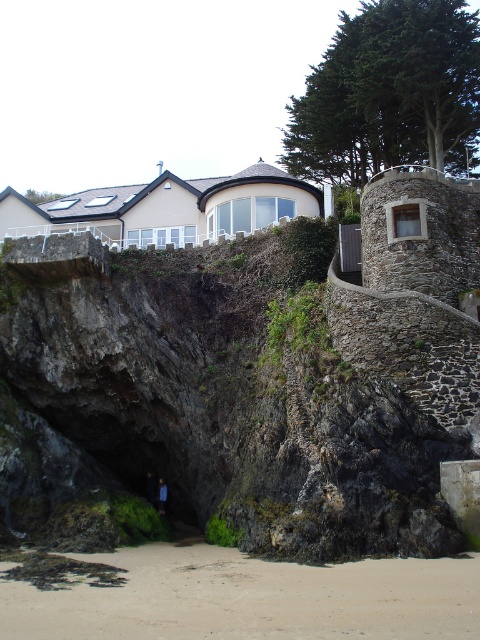
Question: Is rustic stone castle at center below light brown sandy beach at lower center?

Choices:
 (A) yes
 (B) no

Answer: (B)

Question: Among these objects, which one is farthest from the camera?

Choices:
 (A) rustic stone castle at center
 (B) light brown sandy beach at lower center
 (C) blue fabric person at lower center

Answer: (C)

Question: Which of the following is the closest to the observer?

Choices:
 (A) (48, 513)
 (B) (465, 577)
 (C) (162, 486)

Answer: (B)

Question: Can you confirm if light brown sandy beach at lower center is wider than blue fabric person at lower center?

Choices:
 (A) yes
 (B) no

Answer: (A)

Question: Does rustic stone castle at center appear on the right side of light brown sandy beach at lower center?

Choices:
 (A) yes
 (B) no

Answer: (A)

Question: Among these points, which one is farthest from the camera?

Choices:
 (A) (431, 193)
 (B) (165, 512)

Answer: (B)